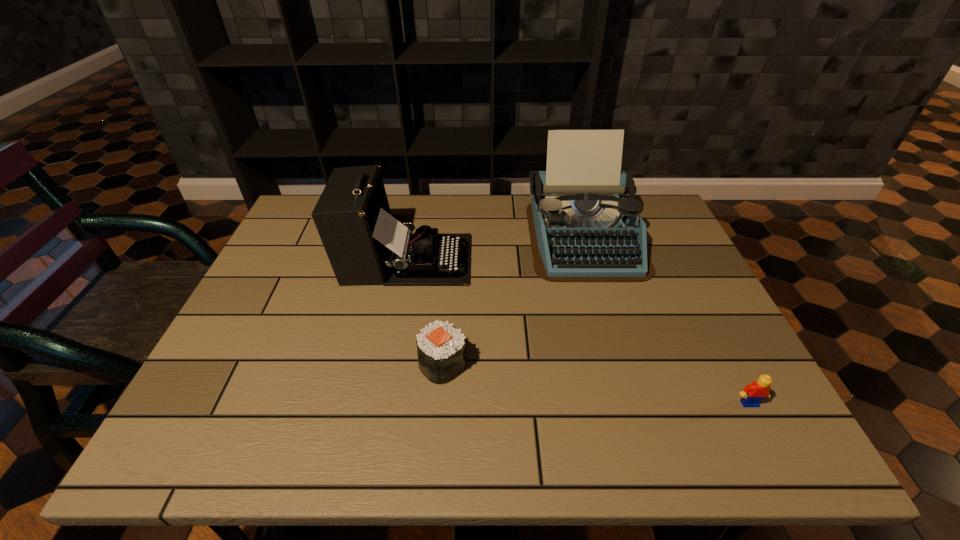
Image resolution: width=960 pixels, height=540 pixels. I want to click on Lego positioned at the right edge, so click(x=752, y=394).

Find the location of a particular element. The width and height of the screenshot is (960, 540). object that is at the far right corner is located at coordinates (584, 224).

The image size is (960, 540). In the image, there is a desktop. What are the coordinates of `vacant area at the far edge` in the screenshot? It's located at (461, 195).

Find the location of a particular element. The height and width of the screenshot is (540, 960). blank space at the near edge is located at coordinates (324, 424).

This screenshot has width=960, height=540. What are the coordinates of `free space at the right edge of the desktop` in the screenshot? It's located at (744, 384).

This screenshot has width=960, height=540. I want to click on vacant space at the far left corner, so click(x=305, y=204).

Identify the location of free space at the far right corner of the desktop. (666, 229).

You are a GUI agent. You are given a task and a screenshot of the screen. Output one action in this format:
    pyautogui.click(x=<x>, y=<y>)
    Task: Click on the empty space between the left typewriter and the Lego
    Image resolution: width=960 pixels, height=540 pixels.
    Given the screenshot: What is the action you would take?
    pyautogui.click(x=578, y=332)

Locate an element on the screen. unoccupied position between the left typewriter and the nearest object is located at coordinates (578, 332).

Locate an element on the screen. free space between the third object from left to right and the rightmost object is located at coordinates (666, 320).